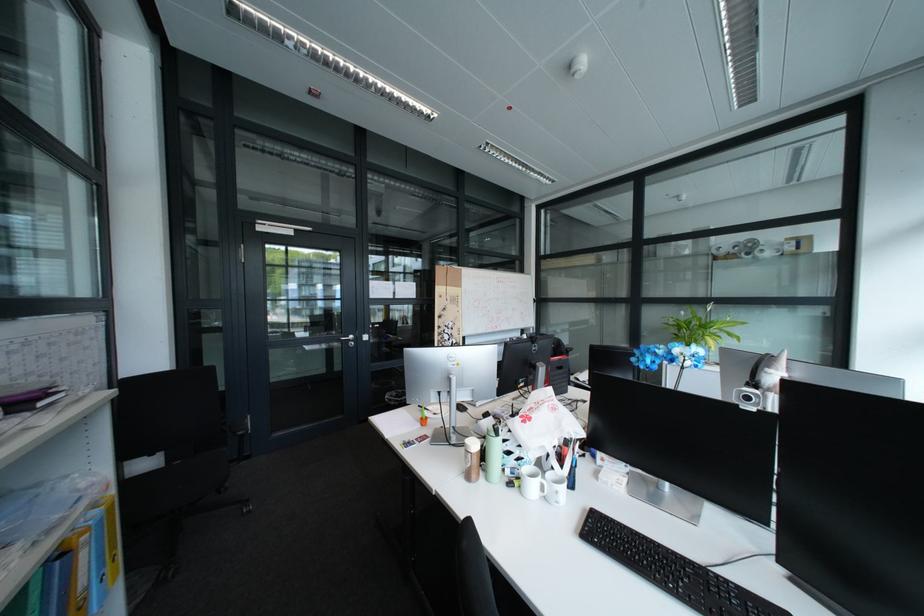
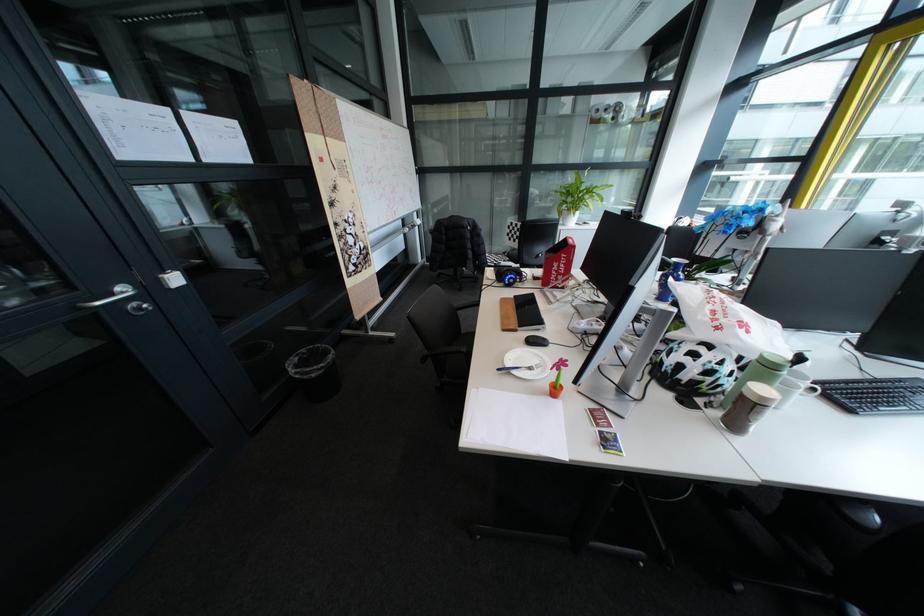
Find the pixel in the second image that matches (553,480) in the first image.

(815, 386)